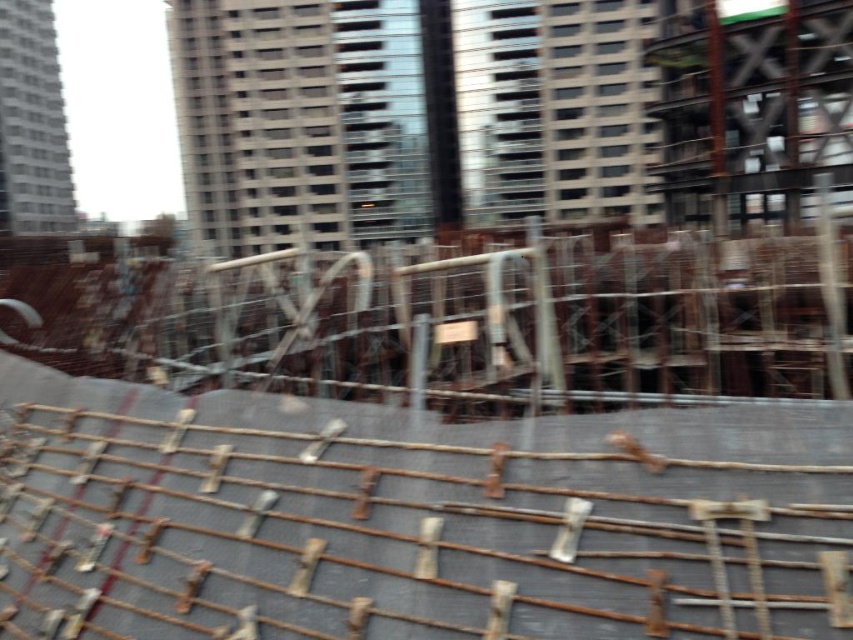
Which is behind, point (519, 596) or point (485, 342)?

Positioned behind is point (485, 342).

Which is in front, point (601, 385) or point (463, 340)?

Point (463, 340)

The height and width of the screenshot is (640, 853). Identify the location of rusty metal rebar at center. (430, 448).